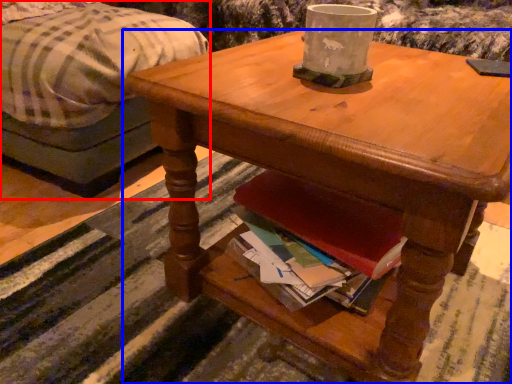
Question: Which object appears farthest to the camera in this image, studio couch (highlighted by a red box) or desk (highlighted by a blue box)?

Choices:
 (A) studio couch
 (B) desk

Answer: (A)